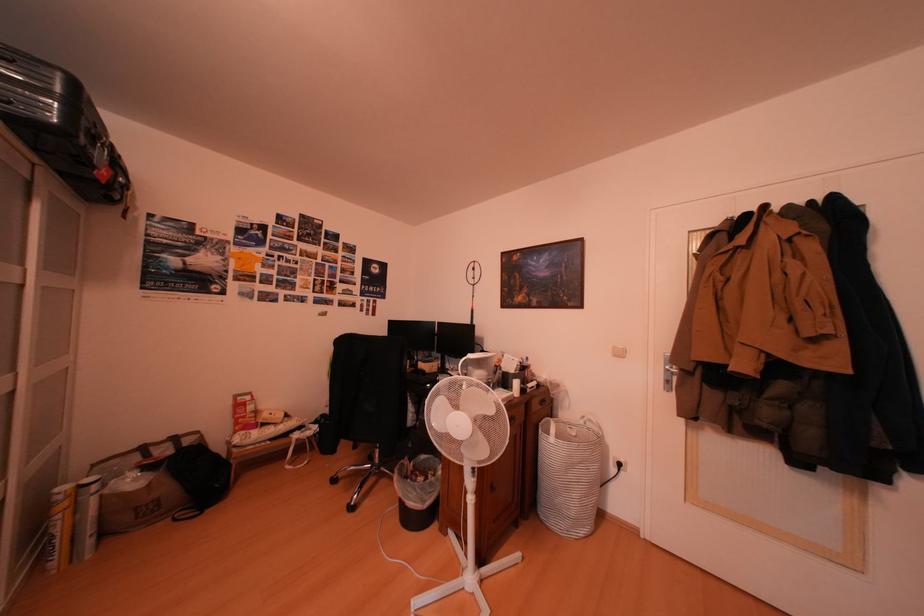
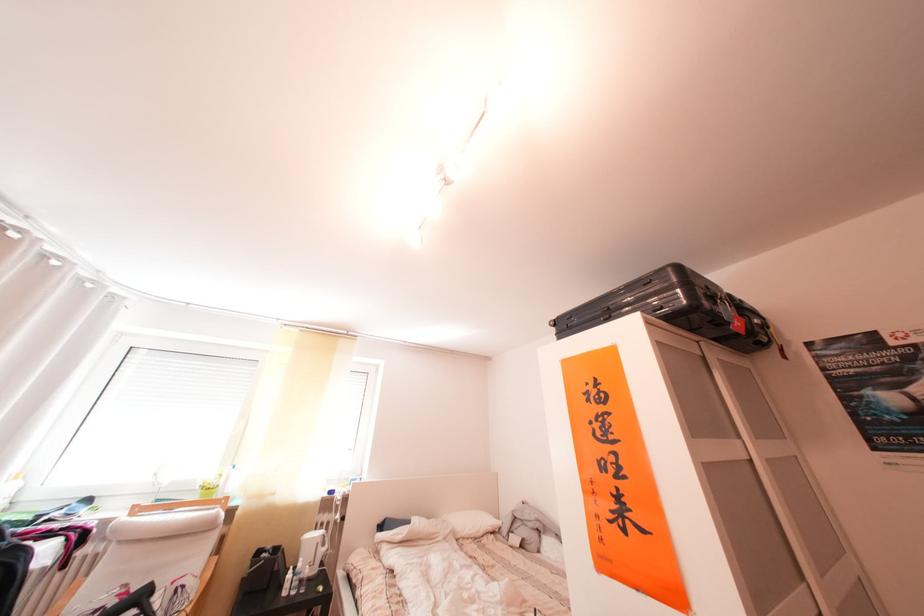
Locate, in the second image, the point that corresponds to pixel 46 154 in the first image.

(703, 336)